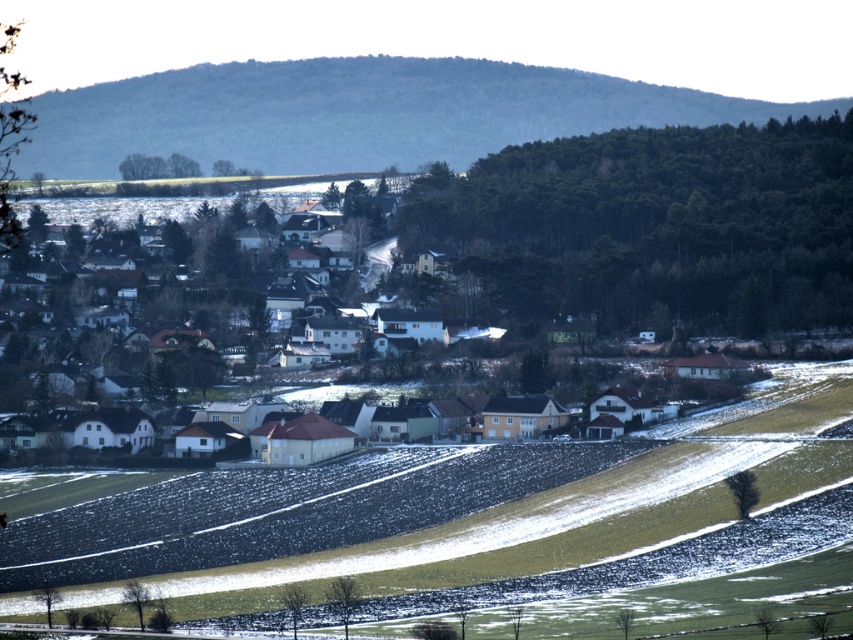
Is green grassy hillside at upper center to the left of white matte houses at center from the viewer's perspective?

No, green grassy hillside at upper center is not to the left of white matte houses at center.

Which is above, green grassy hillside at upper center or white matte houses at center?

green grassy hillside at upper center is higher up.

I want to click on green grassy hillside at upper center, so click(357, 115).